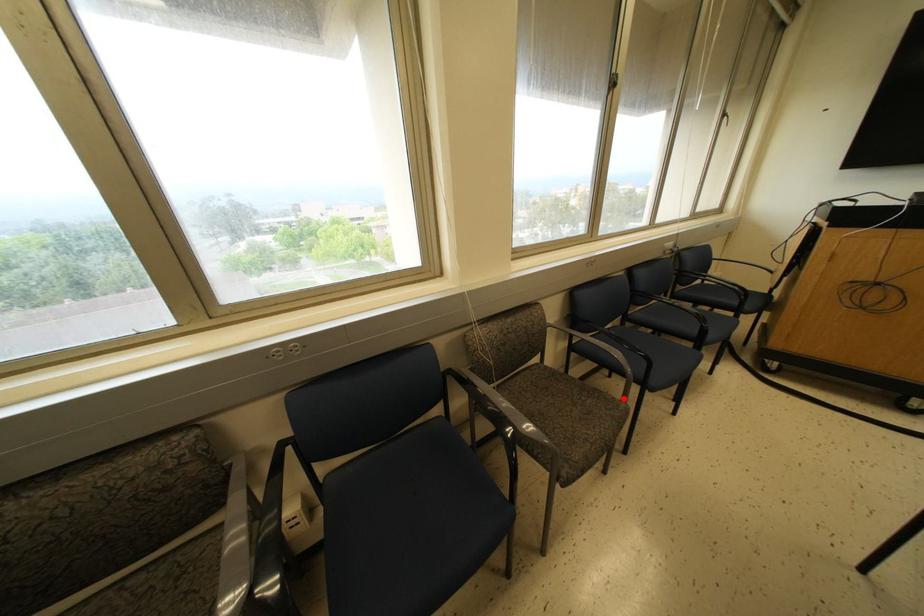
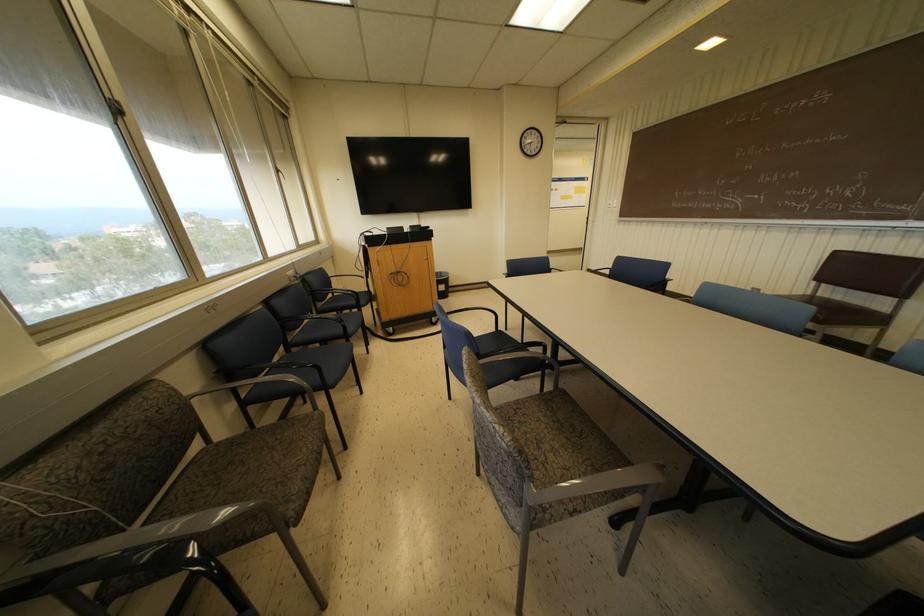
Question: I am providing you with two images of the same scene from different viewpoints. A red point is marked on the first image. Is the red point's position out of view in image 2?

Choices:
 (A) Yes
 (B) No

Answer: (B)